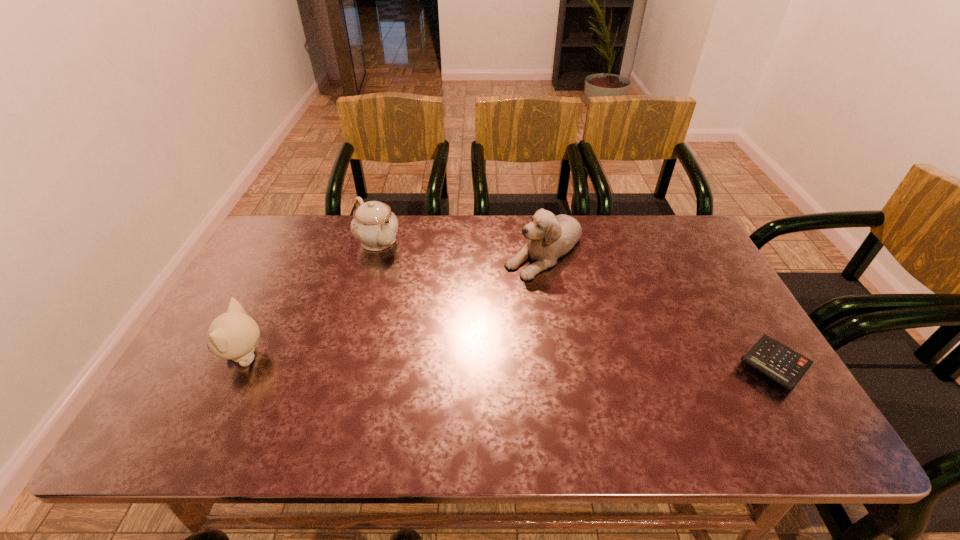
Identify the location of vacant spot on the desktop that is between the leftmost object and the shortest object and is positioned on the front-facing side of the puppy. The width and height of the screenshot is (960, 540). [448, 360].

Image resolution: width=960 pixels, height=540 pixels. What are the coordinates of `vacant space on the desktop that is between the leftmost object and the shortest object and is positioned at the spout of the chinaware` in the screenshot? It's located at (498, 361).